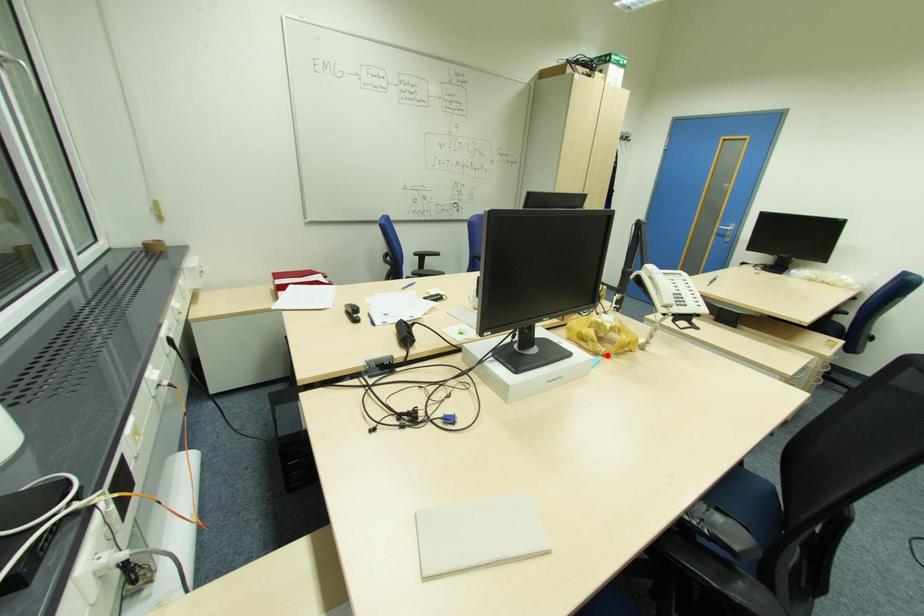
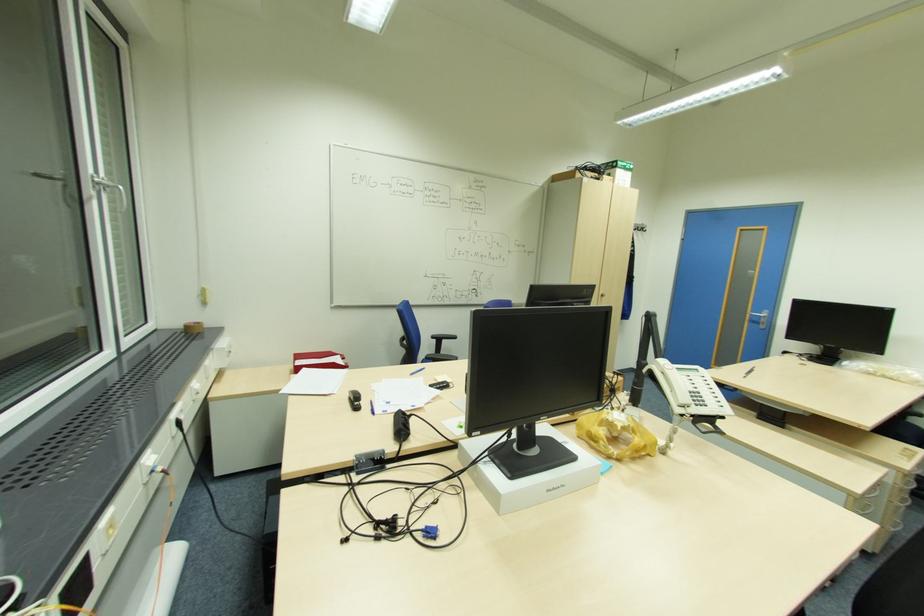
Where in the second image is the point corresponding to the highlighted location from the first image?

(621, 459)